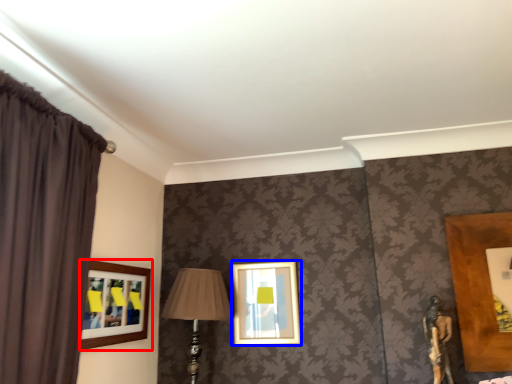
Question: Among these objects, which one is farthest to the camera, picture frame (highlighted by a red box) or picture frame (highlighted by a blue box)?

Choices:
 (A) picture frame
 (B) picture frame

Answer: (B)